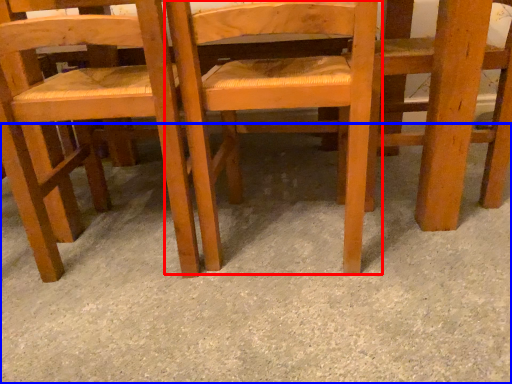
Question: Which object appears farthest to the camera in this image, chair (highlighted by a red box) or concrete (highlighted by a blue box)?

Choices:
 (A) chair
 (B) concrete

Answer: (A)